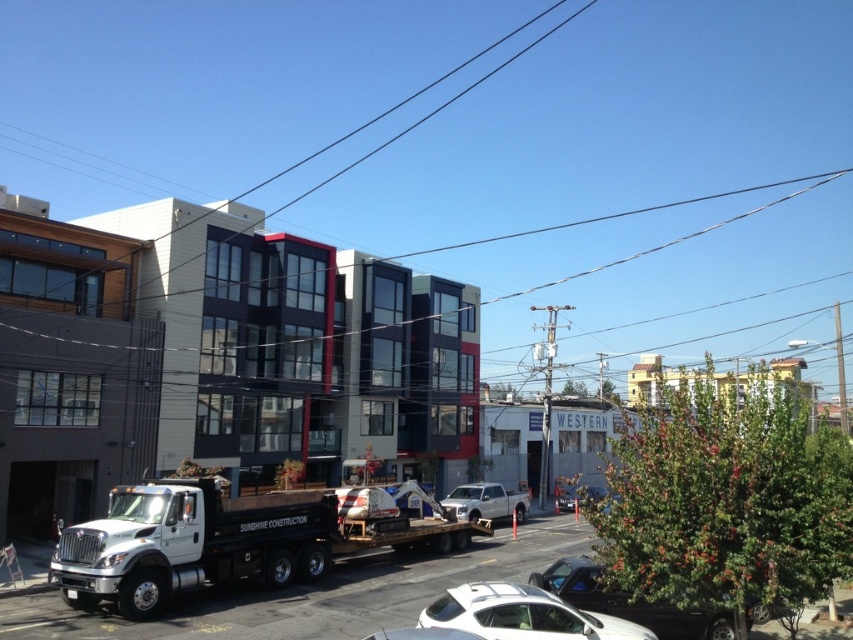
Question: Is white matte tow truck at lower left behind metallic silver sedan at lower center?

Choices:
 (A) yes
 (B) no

Answer: (A)

Question: Is metallic silver sedan at lower center positioned in front of metallic silver sedan at center?

Choices:
 (A) yes
 (B) no

Answer: (A)

Question: Which of the following is the farthest from the observer?

Choices:
 (A) (583, 484)
 (B) (502, 515)
 (C) (660, 612)

Answer: (A)

Question: Does white matte suv at center lie behind white matte truck at center?

Choices:
 (A) no
 (B) yes

Answer: (A)

Question: Based on their relative distances, which object is farther from the white matte tow truck at lower left?

Choices:
 (A) white matte suv at center
 (B) metallic silver sedan at center

Answer: (B)

Question: Considering the real-world distances, which object is closest to the white matte tow truck at lower left?

Choices:
 (A) white matte suv at center
 (B) white matte truck at center
 (C) metallic silver sedan at lower center

Answer: (B)